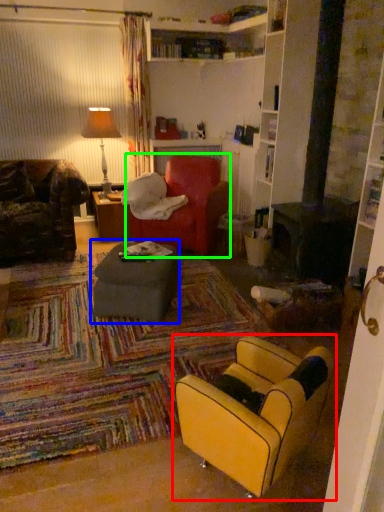
Question: Considering the real-world distances, which object is closest to chair (highlighted by a red box)? table (highlighted by a blue box) or bean bag chair (highlighted by a green box).

Choices:
 (A) table
 (B) bean bag chair

Answer: (A)